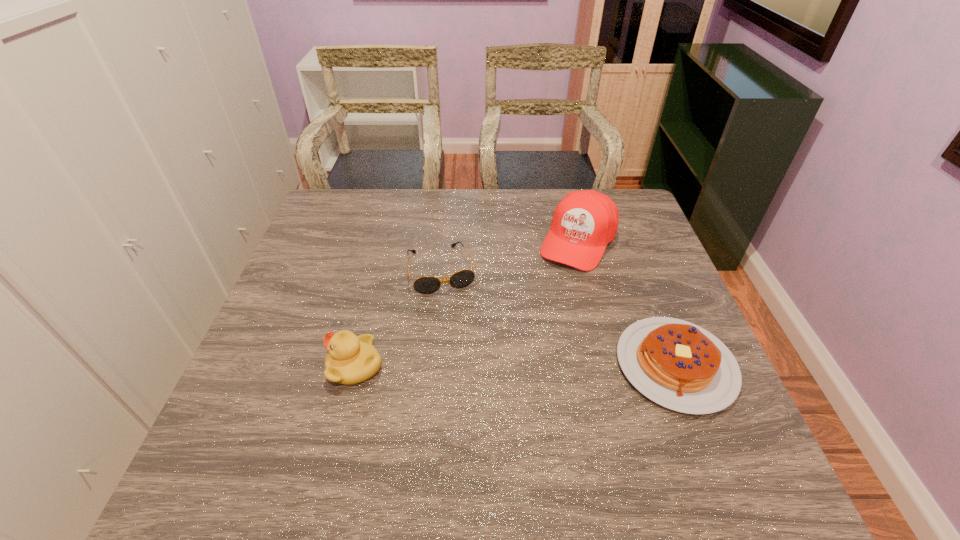
At what (x,y) coordinates should I click in order to perform the action: click on object that is positioned at the near right corner. Please return your answer as a coordinate pair (x, y). This screenshot has height=540, width=960. Looking at the image, I should click on (677, 364).

Find the location of a particular element. free space at the far edge is located at coordinates (417, 192).

The width and height of the screenshot is (960, 540). What are the coordinates of `blank area at the near edge` in the screenshot? It's located at (632, 418).

Find the location of a particular element. This screenshot has height=540, width=960. free region at the right edge of the desktop is located at coordinates (676, 284).

Where is `free space at the far left corner of the desktop`? The image size is (960, 540). free space at the far left corner of the desktop is located at coordinates (326, 196).

At what (x,y) coordinates should I click in order to perform the action: click on vacant space at the near left corner of the desktop. Please return your answer as a coordinate pair (x, y). Looking at the image, I should click on (225, 417).

Find the location of a particular element. empty space that is in between the second tallest object and the tallest object is located at coordinates (467, 303).

Where is `free space between the second object from left to right and the pancake`? This screenshot has width=960, height=540. free space between the second object from left to right and the pancake is located at coordinates (559, 318).

In order to click on empty space between the third object from right to left and the pancake in this screenshot , I will do `click(559, 318)`.

I want to click on free area in between the baseball cap and the duckling, so click(x=467, y=303).